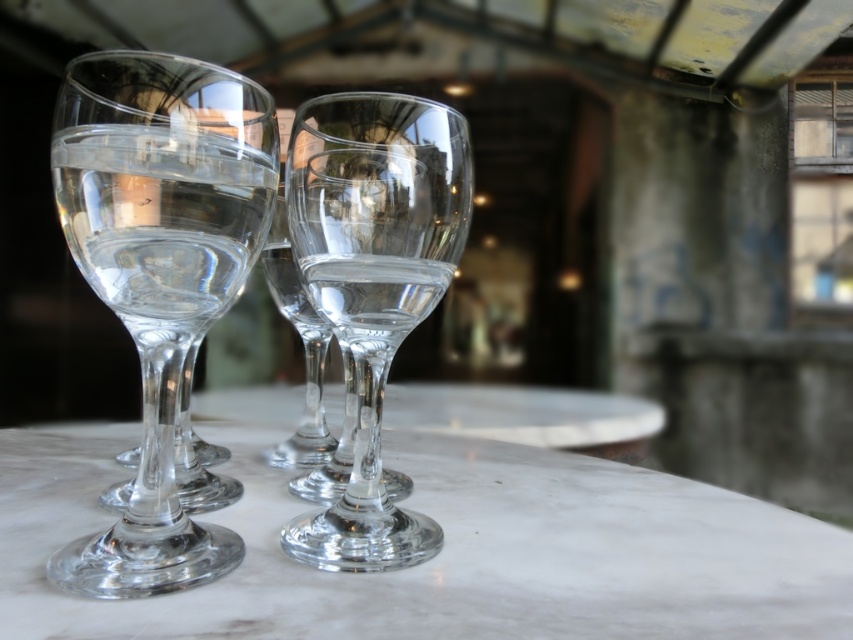
Who is shorter, transparent glass table at center or transparent glass wine glass at center?

Standing shorter between the two is transparent glass table at center.

Is transparent glass table at center further to the viewer compared to transparent glass wine glass at center?

No, transparent glass table at center is in front of transparent glass wine glass at center.

Which is in front, point (311, 582) or point (376, 131)?

Point (311, 582) is more forward.

You are a GUI agent. You are given a task and a screenshot of the screen. Output one action in this format:
    pyautogui.click(x=<x>, y=<y>)
    Task: Click on the transparent glass table at center
    The image size is (853, 640).
    Given the screenshot: What is the action you would take?
    pyautogui.click(x=444, y=532)

Which is more to the left, transparent glass wine glass at left or transparent glass wine glass at center?

Positioned to the left is transparent glass wine glass at left.

Is transparent glass wine glass at left to the right of transparent glass wine glass at center from the viewer's perspective?

No, transparent glass wine glass at left is not to the right of transparent glass wine glass at center.

Describe the element at coordinates (160, 272) in the screenshot. I see `transparent glass wine glass at left` at that location.

Find the location of `transparent glass wine glass at left`. transparent glass wine glass at left is located at coordinates (160, 272).

Looking at this image, between transparent glass table at center and transparent glass wine glass at left, which one appears on the right side from the viewer's perspective?

Positioned to the right is transparent glass table at center.

Between point (64, 445) and point (229, 125), which one is positioned behind?

Positioned behind is point (64, 445).

The image size is (853, 640). Identify the location of transparent glass table at center. pos(444,532).